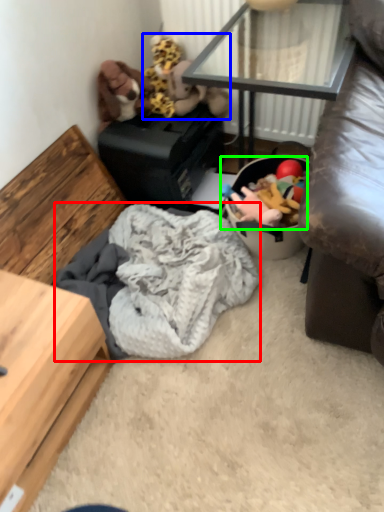
Question: Considering the real-world distances, which object is closest to clothing (highlighted by a red box)? toy (highlighted by a blue box) or stuff (highlighted by a green box).

Choices:
 (A) toy
 (B) stuff

Answer: (B)